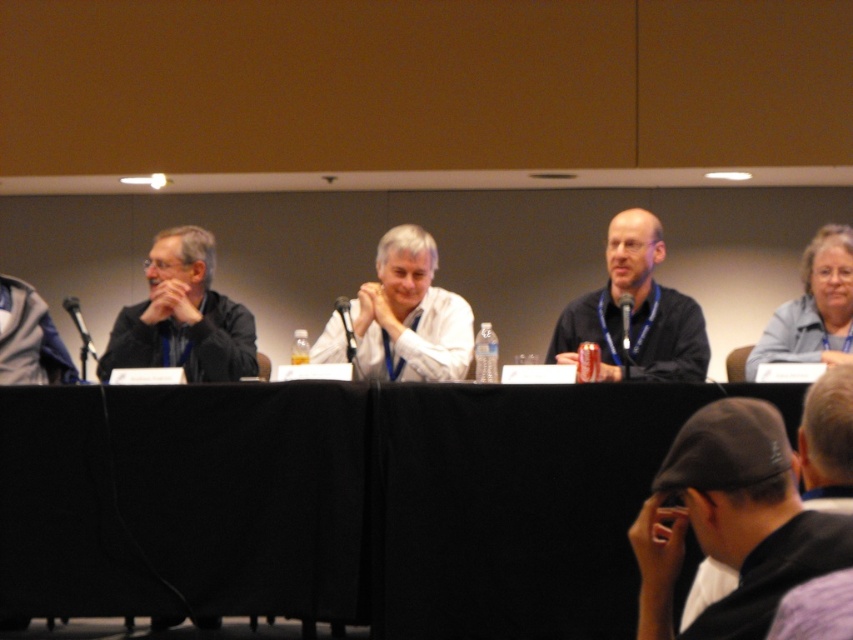
Question: Can you confirm if black fabric cap at lower right is positioned above matte black shirt at left?

Choices:
 (A) no
 (B) yes

Answer: (A)

Question: Does matte black shirt at left have a smaller size compared to white matte shirt at center?

Choices:
 (A) no
 (B) yes

Answer: (A)

Question: Which point appears farthest from the camera in this image?

Choices:
 (A) (651, 326)
 (B) (685, 508)

Answer: (A)

Question: Which point is closer to the camera taking this photo?

Choices:
 (A) (846, 285)
 (B) (756, 518)

Answer: (B)

Question: Which of the following is the closest to the observer?

Choices:
 (A) matte black shirt at center
 (B) black fabric cap at lower right

Answer: (B)

Question: Can you confirm if matte black shirt at left is positioned to the left of gray fabric jacket at upper right?

Choices:
 (A) yes
 (B) no

Answer: (A)